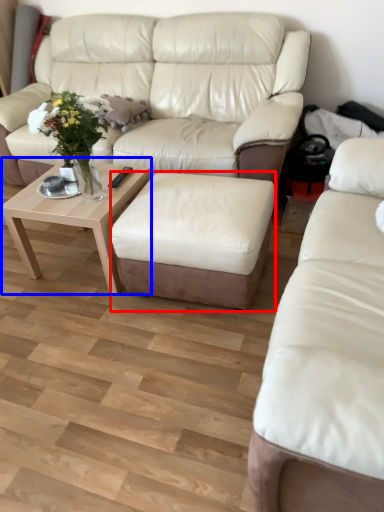
Question: Which point is closer to the camera, stool (highlighted by a red box) or coffee table (highlighted by a blue box)?

Choices:
 (A) stool
 (B) coffee table

Answer: (A)